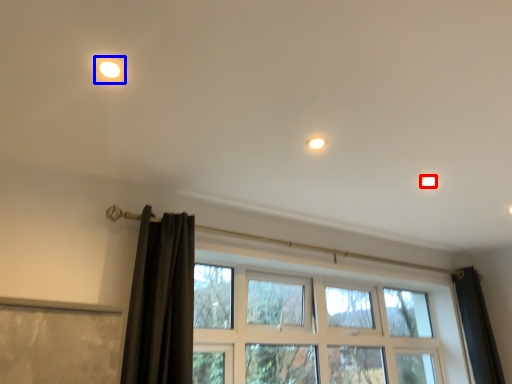
Question: Which of the following is the closest to the observer, dot (highlighted by a red box) or light (highlighted by a blue box)?

Choices:
 (A) dot
 (B) light

Answer: (B)